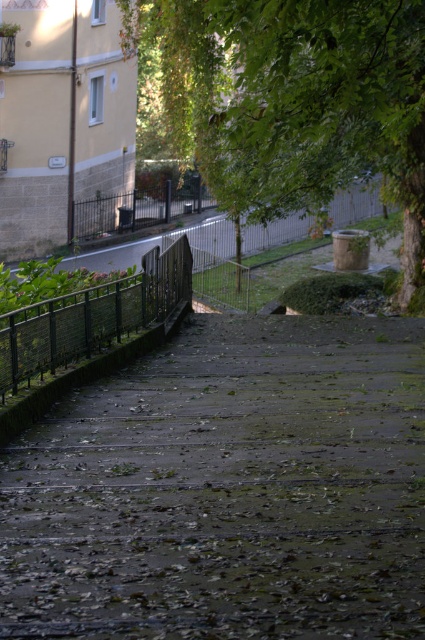
Does point (374, 150) lie in front of point (54, 301)?

No, (374, 150) is behind (54, 301).

Does point (399, 132) come farther from viewer compared to point (19, 365)?

Yes, point (399, 132) is behind point (19, 365).

Does point (172, 92) lie behind point (50, 333)?

Yes, it is behind point (50, 333).

The image size is (425, 640). In order to click on green leafy tree at upper center in this screenshot , I will do `click(294, 100)`.

Who is more distant from viewer, [65,420] or [269,128]?

Positioned behind is point [65,420].

Can you confirm if dark gray concrete stairs at center is positioned to the right of green leafy tree at upper center?

Correct, you'll find dark gray concrete stairs at center to the right of green leafy tree at upper center.

Is point (268, 506) positioned behind point (337, 125)?

No.

This screenshot has width=425, height=640. Identify the location of dark gray concrete stairs at center. point(226,490).

Who is positioned more to the left, dark gray concrete stairs at center or green metal fence at left?

From the viewer's perspective, green metal fence at left appears more on the left side.

Is dark gray concrete stairs at center positioned at the back of green metal fence at left?

No, dark gray concrete stairs at center is in front of green metal fence at left.

Does point (266, 522) come in front of point (172, 276)?

Yes, it is.

The image size is (425, 640). Identify the location of dark gray concrete stairs at center. (226, 490).